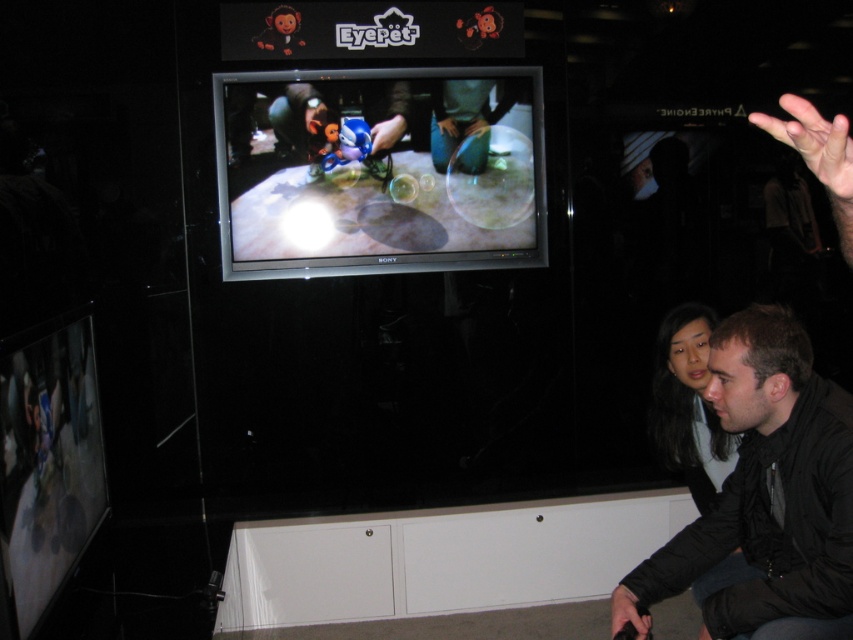
You are standing in the exhibit space and want to take a photo of the black matte jacket at lower right and dark brown hair at lower right without blocking the TV screen. Which object should you move to the right to get a clear shot?

You should move the dark brown hair at lower right to the right since the black matte jacket at lower right is to the left of dark brown hair at lower right, so shifting the latter rightward would allow both objects to be framed without blocking the TV screen.

You are trying to decide where to place a new decorative item in the exhibit space. The shiny silver tv at center and the black matte jacket at lower right are already present. Which object takes up more space in the scene?

The black matte jacket at lower right occupies more space than the shiny silver tv at center according to the description.

You are standing in the gaming exhibit and want to take a photo of the shiny silver tv at center and the dark brown hair at lower right. To ensure both are in frame, should you position yourself to the left or right of the scene?

You should position yourself to the right of the scene because the shiny silver tv at center is to the left of dark brown hair at lower right, so placing yourself to the right would allow both objects to be captured in the frame.